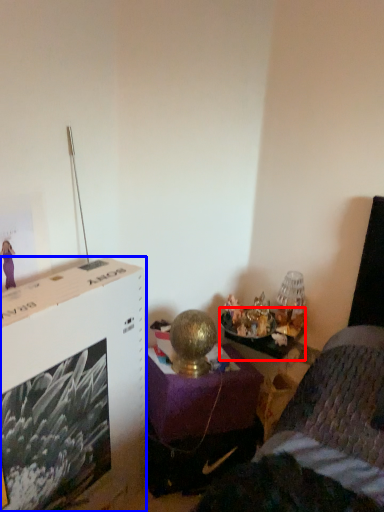
Question: Which of the following is the closest to the observer, table (highlighted by a red box) or file cabinet (highlighted by a blue box)?

Choices:
 (A) table
 (B) file cabinet

Answer: (B)